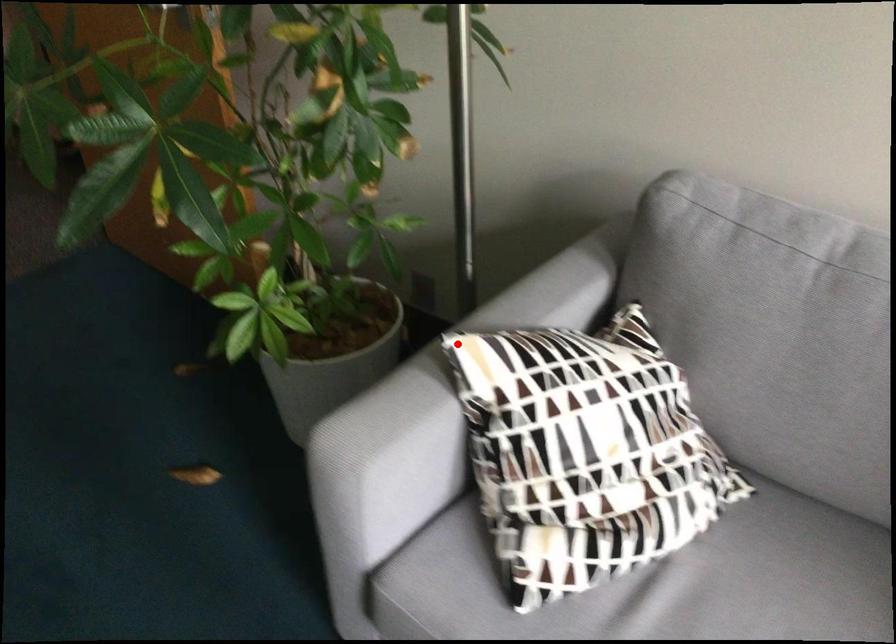
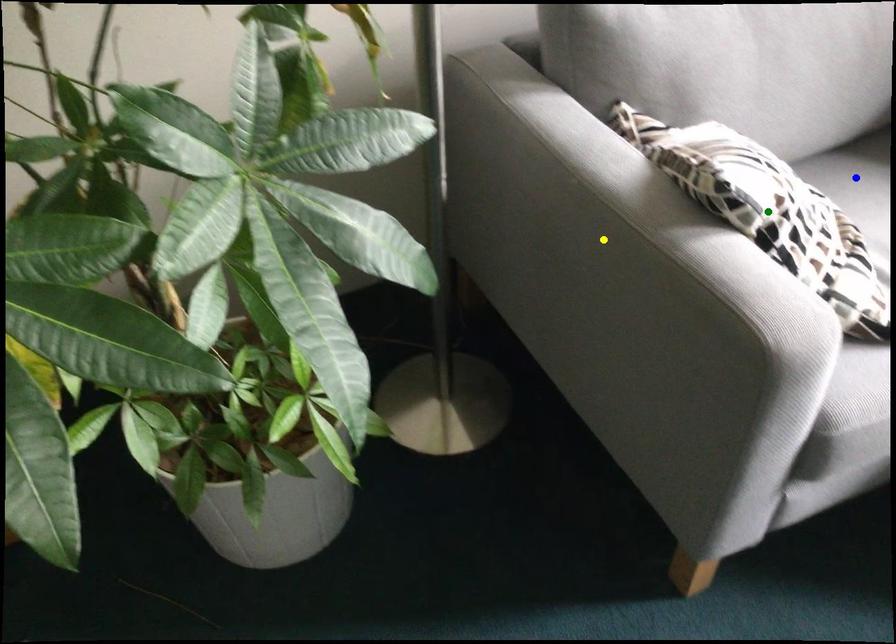
Question: I am providing you with two images of the same scene from different viewpoints. A red point is marked on the first image. You are given multiple points on the second image. Which spot in image 2 lines up with the point in image 1?

Choices:
 (A) blue point
 (B) green point
 (C) yellow point

Answer: (C)